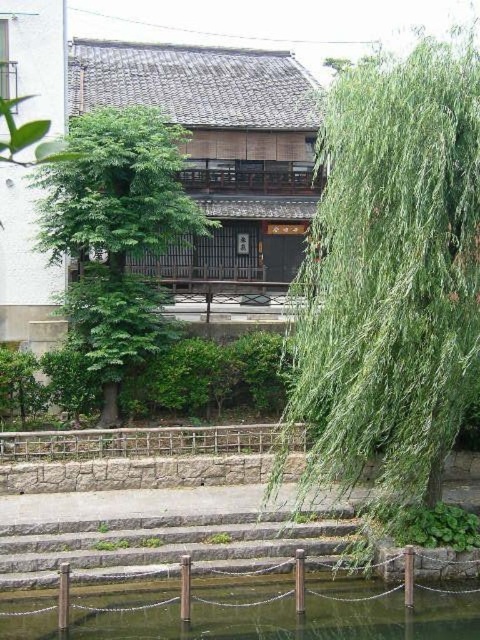
Question: Observing the image, what is the correct spatial positioning of clear glass water at lower center in reference to stone steps at center?

Choices:
 (A) right
 (B) left

Answer: (A)

Question: Does green leafy tree at center have a lesser width compared to stone steps at center?

Choices:
 (A) no
 (B) yes

Answer: (B)

Question: Can you confirm if green leafy willow at right is smaller than clear glass water at lower center?

Choices:
 (A) no
 (B) yes

Answer: (A)

Question: Which object appears closest to the camera in this image?

Choices:
 (A) green leafy tree at center
 (B) clear glass water at lower center

Answer: (B)

Question: Which object is the farthest from the green leafy tree at center?

Choices:
 (A) clear glass water at lower center
 (B) green leafy willow at right
 (C) stone steps at center

Answer: (A)

Question: Which point is closer to the camera?

Choices:
 (A) (276, 589)
 (B) (129, 316)
 (C) (424, 241)

Answer: (C)